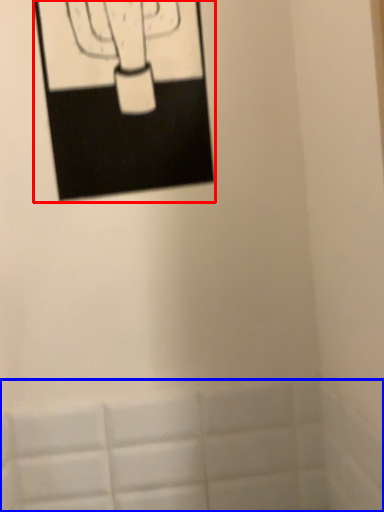
Question: Which object appears farthest to the camera in this image, picture frame (highlighted by a red box) or bath (highlighted by a blue box)?

Choices:
 (A) picture frame
 (B) bath

Answer: (B)